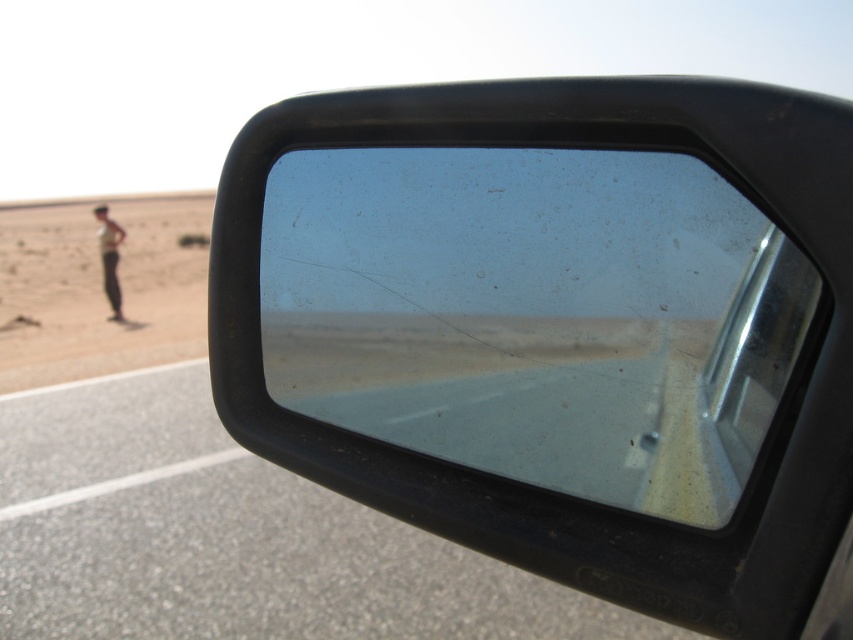
Between desertdry sand at left and light brown skin at lower left, which one is positioned higher?

light brown skin at lower left is above.

The image size is (853, 640). Describe the element at coordinates (100, 291) in the screenshot. I see `desertdry sand at left` at that location.

Does point (0, 310) come behind point (103, 212)?

Yes, it is.

This screenshot has height=640, width=853. I want to click on desertdry sand at left, so click(x=100, y=291).

Is clear plastic mirror at center shorter than light brown skin at lower left?

Yes.

Which of these two, clear plastic mirror at center or light brown skin at lower left, stands shorter?

clear plastic mirror at center

Where is `clear plastic mirror at center`? This screenshot has height=640, width=853. clear plastic mirror at center is located at coordinates (535, 314).

Describe the element at coordinates (758, 348) in the screenshot. This screenshot has width=853, height=640. I see `clear glass window at center` at that location.

Is point (723, 344) farther from camera compared to point (109, 260)?

No, (723, 344) is in front of (109, 260).

Between point (802, 328) and point (109, 230), which one is positioned in front?

Point (802, 328) is in front.

The width and height of the screenshot is (853, 640). I want to click on clear glass window at center, so click(758, 348).